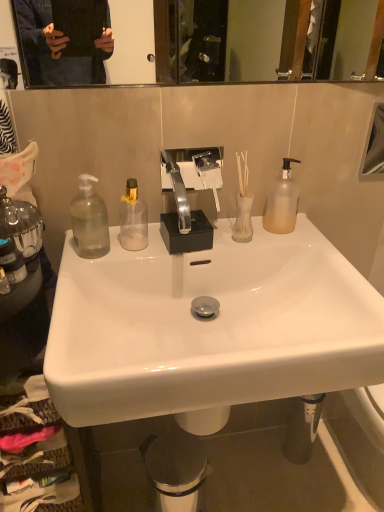
Question: Considering the relative sizes of frosted glass pump bottle at right, the first bottle from the right, and glossy glass mirror at upper right in the image provided, is frosted glass pump bottle at right, the first bottle from the right, smaller than glossy glass mirror at upper right?

Choices:
 (A) no
 (B) yes

Answer: (B)

Question: Is frosted glass pump bottle at right, the fifth bottle from the left, oriented towards glossy glass mirror at upper right?

Choices:
 (A) no
 (B) yes

Answer: (A)

Question: Is frosted glass pump bottle at right, the first bottle from the right, beside glossy glass mirror at upper right?

Choices:
 (A) yes
 (B) no

Answer: (B)

Question: From a real-world perspective, does frosted glass pump bottle at right, the fifth bottle from the left, stand above glossy glass mirror at upper right?

Choices:
 (A) no
 (B) yes

Answer: (A)

Question: Considering the relative sizes of frosted glass pump bottle at right, the first bottle from the right, and glossy glass mirror at upper right in the image provided, is frosted glass pump bottle at right, the first bottle from the right, taller than glossy glass mirror at upper right?

Choices:
 (A) yes
 (B) no

Answer: (A)

Question: Is glossy glass mirror at upper right a part of frosted glass pump bottle at right, the fifth bottle from the left?

Choices:
 (A) no
 (B) yes

Answer: (A)

Question: Is metallic trash can at lower center wider than white glossy sink at center?

Choices:
 (A) yes
 (B) no

Answer: (A)

Question: Is the position of metallic trash can at lower center less distant than that of white glossy sink at center?

Choices:
 (A) no
 (B) yes

Answer: (A)

Question: Is metallic trash can at lower center to the left of white glossy sink at center from the viewer's perspective?

Choices:
 (A) yes
 (B) no

Answer: (A)

Question: Can you confirm if metallic trash can at lower center is thinner than white glossy sink at center?

Choices:
 (A) no
 (B) yes

Answer: (A)

Question: Is metallic trash can at lower center aimed at white glossy sink at center?

Choices:
 (A) no
 (B) yes

Answer: (A)

Question: Is metallic trash can at lower center completely or partially outside of white glossy sink at center?

Choices:
 (A) no
 (B) yes

Answer: (B)

Question: Considering the relative sizes of metallic trash can at lower center and frosted glass pump bottle at right, the fifth bottle from the left, in the image provided, is metallic trash can at lower center taller than frosted glass pump bottle at right, the fifth bottle from the left,?

Choices:
 (A) yes
 (B) no

Answer: (A)